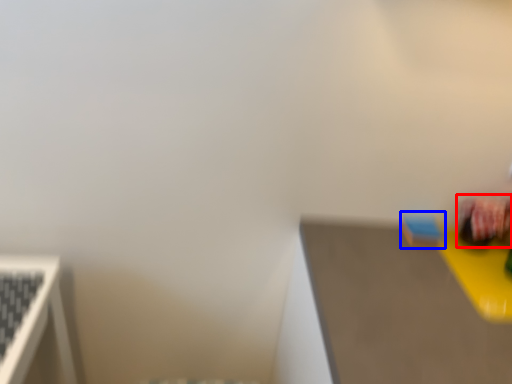
Question: Which object is further to the camera taking this photo, toy (highlighted by a red box) or toy (highlighted by a blue box)?

Choices:
 (A) toy
 (B) toy

Answer: (B)